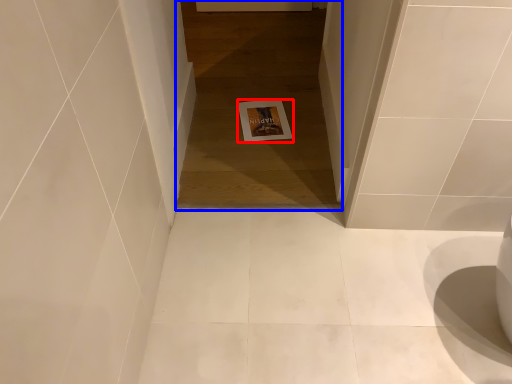
Question: Which object appears farthest to the camera in this image, postcard (highlighted by a red box) or passage (highlighted by a blue box)?

Choices:
 (A) postcard
 (B) passage

Answer: (A)